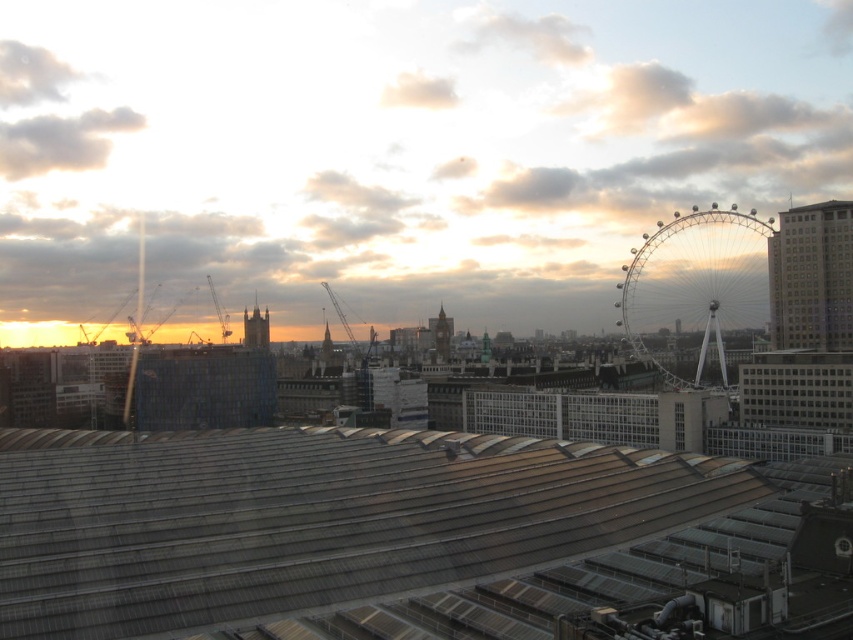
You are an architect analyzing the cityscape. Based on the image, which object, the metallic gray roof at center or the silver metallic ferris wheel at upper right, appears to be closer to the viewer?

The metallic gray roof at center appears closer to the viewer because it is smaller than the silver metallic ferris wheel at upper right, which is larger and thus likely farther away.

You are a tourist standing in the city and want to take a photo of both the metallic gray roof at center and the silver metallic ferris wheel at upper right. Based on their positions, which object should you frame first in your camera viewfinder to ensure both are in the shot?

You should frame the metallic gray roof at center first since it is closer to the viewer than the silver metallic ferris wheel at upper right, ensuring both will be in the shot when adjusting the camera angle.